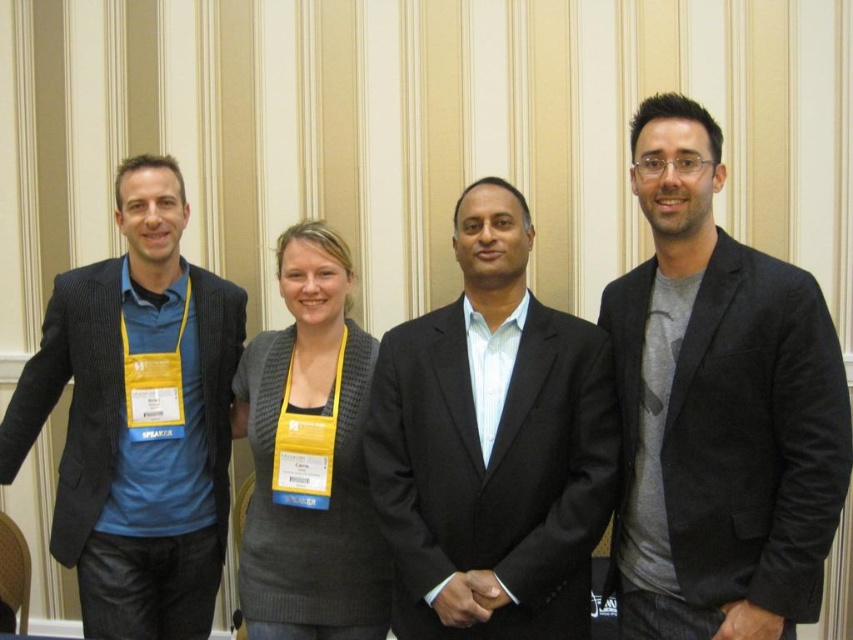
Question: Which point appears farthest from the camera in this image?

Choices:
 (A) (381, 515)
 (B) (165, 314)
 (C) (350, 392)
 (D) (782, 454)

Answer: (B)

Question: Does dark gray cotton blazer at right lie in front of matte black blazer at left?

Choices:
 (A) yes
 (B) no

Answer: (A)

Question: Can you confirm if dark gray cotton blazer at right is smaller than matte black blazer at left?

Choices:
 (A) yes
 (B) no

Answer: (A)

Question: Which point is closer to the camera taking this photo?

Choices:
 (A) (593, 516)
 (B) (238, 413)
 (C) (97, 291)

Answer: (A)

Question: Considering the real-world distances, which object is farthest from the matte black suit at center?

Choices:
 (A) knit gray sweater at center
 (B) dark gray cotton blazer at right
 (C) matte black blazer at left

Answer: (C)

Question: Can you confirm if matte black blazer at left is positioned below knit gray sweater at center?

Choices:
 (A) no
 (B) yes

Answer: (A)